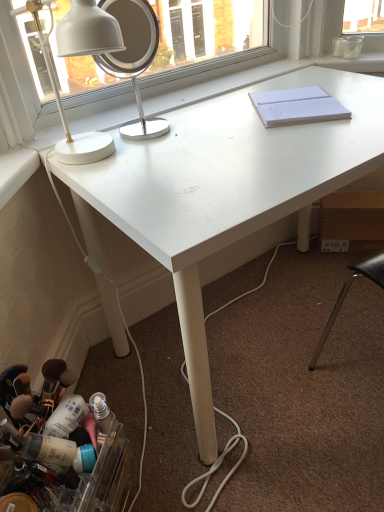
Image resolution: width=384 pixels, height=512 pixels. In order to click on free location above white paper notebook at upper right (from a real-world perspective) in this screenshot , I will do `click(298, 103)`.